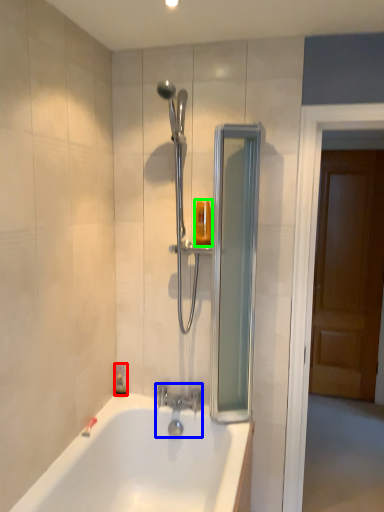
Question: Based on their relative distances, which object is farther from soap dispenser (highlighted by a red box)? Choose from tap (highlighted by a blue box) and toiletry (highlighted by a green box).

Choices:
 (A) tap
 (B) toiletry

Answer: (B)